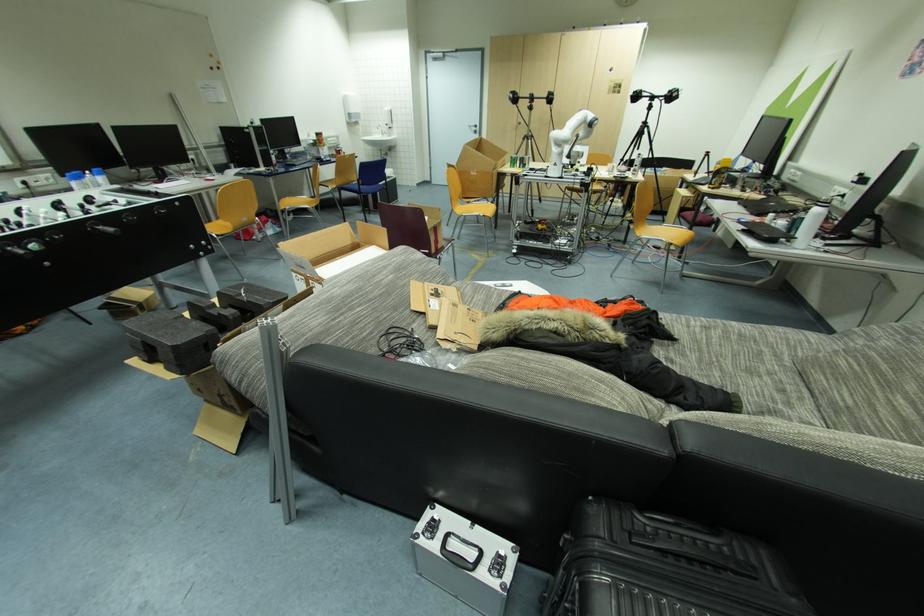
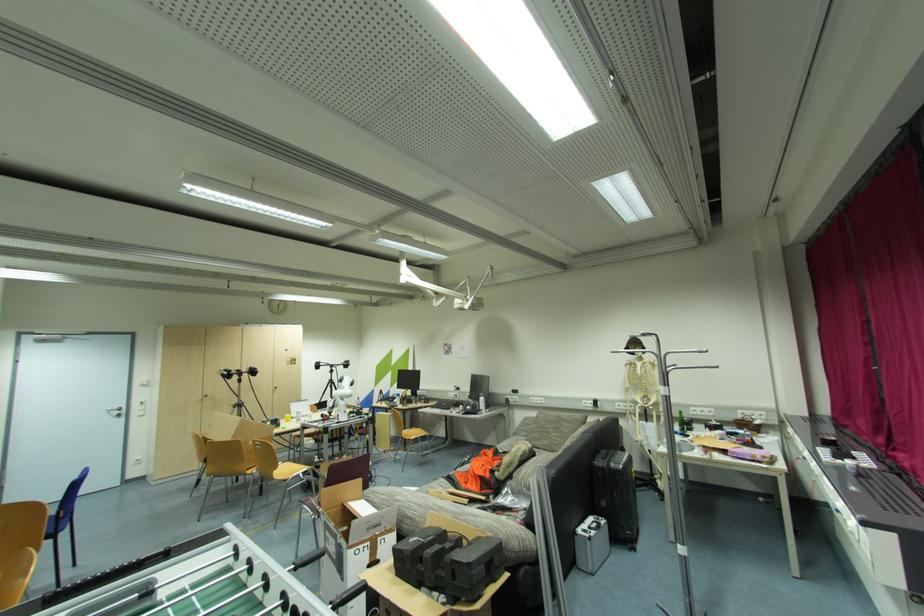
Where in the second image is the point corresponding to point 495,546 from the first image?

(593, 520)